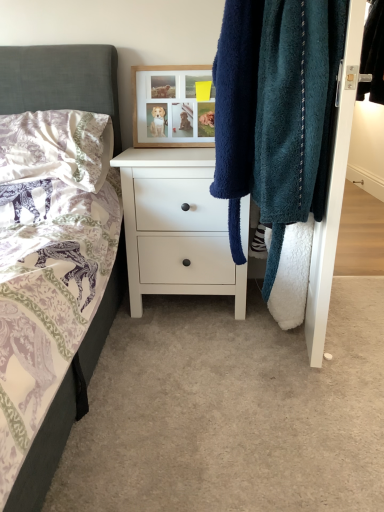
Question: Considering the relative positions of black leather jacket at upper right and teal fuzzy towel at right in the image provided, is black leather jacket at upper right to the right of teal fuzzy towel at right from the viewer's perspective?

Choices:
 (A) yes
 (B) no

Answer: (A)

Question: From the image's perspective, is black leather jacket at upper right located beneath teal fuzzy towel at right?

Choices:
 (A) yes
 (B) no

Answer: (B)

Question: Is teal fuzzy towel at right inside black leather jacket at upper right?

Choices:
 (A) yes
 (B) no

Answer: (B)

Question: Are black leather jacket at upper right and teal fuzzy towel at right beside each other?

Choices:
 (A) no
 (B) yes

Answer: (A)

Question: Is black leather jacket at upper right positioned with its back to teal fuzzy towel at right?

Choices:
 (A) no
 (B) yes

Answer: (A)

Question: Can you confirm if black leather jacket at upper right is taller than teal fuzzy towel at right?

Choices:
 (A) yes
 (B) no

Answer: (B)

Question: Considering the relative positions of teal fuzzy towel at right and white matte chest of drawers at center in the image provided, is teal fuzzy towel at right in front of white matte chest of drawers at center?

Choices:
 (A) yes
 (B) no

Answer: (A)

Question: Considering the relative positions of teal fuzzy towel at right and white matte chest of drawers at center in the image provided, is teal fuzzy towel at right to the left of white matte chest of drawers at center from the viewer's perspective?

Choices:
 (A) no
 (B) yes

Answer: (A)

Question: Is teal fuzzy towel at right turned away from white matte chest of drawers at center?

Choices:
 (A) no
 (B) yes

Answer: (A)

Question: From the image's perspective, is teal fuzzy towel at right beneath white matte chest of drawers at center?

Choices:
 (A) yes
 (B) no

Answer: (B)

Question: Does teal fuzzy towel at right come behind white matte chest of drawers at center?

Choices:
 (A) yes
 (B) no

Answer: (B)

Question: From the image's perspective, is teal fuzzy towel at right on white matte chest of drawers at center?

Choices:
 (A) yes
 (B) no

Answer: (A)

Question: Is wooden picture frame at upper center facing away from teal fuzzy towel at right?

Choices:
 (A) no
 (B) yes

Answer: (A)